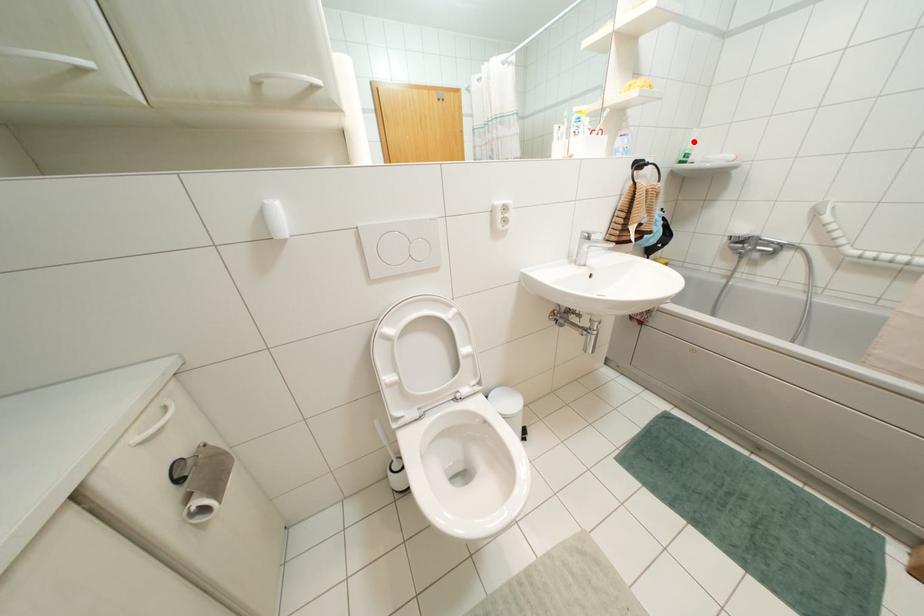
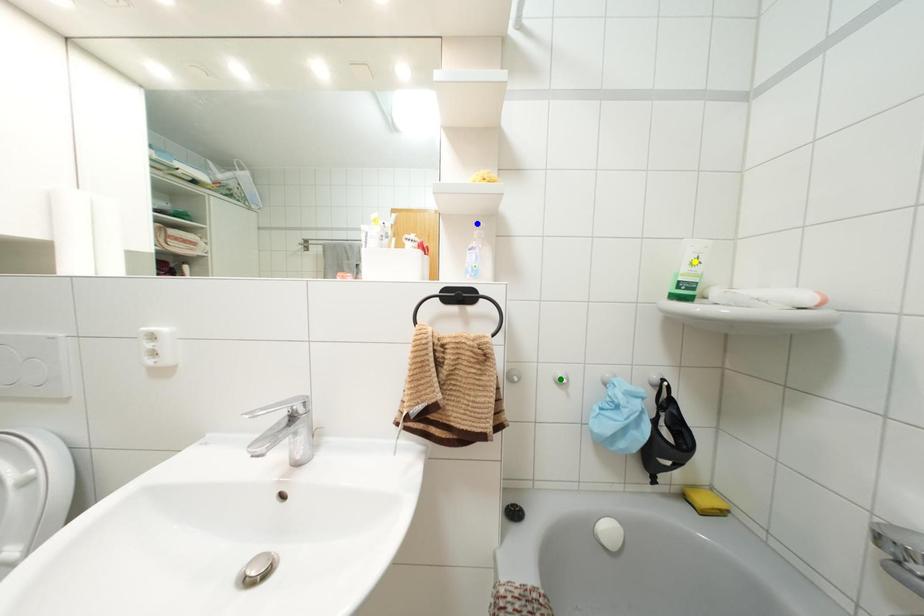
Question: I am providing you with two images of the same scene from different viewpoints. A red point is marked on the first image. You are given multiple points on the second image. Which mark in image 2 goes with the point in image 1?

Choices:
 (A) blue point
 (B) green point
 (C) yellow point

Answer: (C)